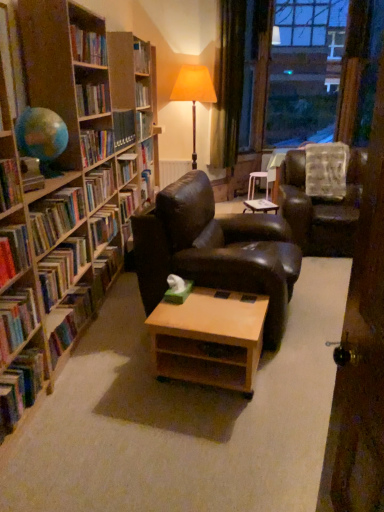
Question: Considering the positions of transparent glass window at upper right and hardcover books at left, marked as the 5th book in a top-to-bottom arrangement, in the image, is transparent glass window at upper right taller or shorter than hardcover books at left, marked as the 5th book in a top-to-bottom arrangement,?

Choices:
 (A) tall
 (B) short

Answer: (A)

Question: Based on their sizes in the image, would you say transparent glass window at upper right is bigger or smaller than hardcover books at left, marked as the 4th book in a bottom-to-top arrangement?

Choices:
 (A) big
 (B) small

Answer: (A)

Question: Which is farther from the leather armchair at center, acting as the 1th chair starting from the front?

Choices:
 (A) hardcover book at lower left, the first book ordered from the bottom
 (B) hardcover book at left, which is the 2th book in bottom-to-top order
 (C) green velvet curtain at upper right
 (D) hardcover book at left, the fourth book positioned from the top
 (E) hardcover books at left, the sixth book when ordered from bottom to top

Answer: (C)

Question: Which object is positioned closest to the leather armchair at center, acting as the 1th chair starting from the front?

Choices:
 (A) hardcover books at left, marked as the 4th book in a bottom-to-top arrangement
 (B) hardcover book at lower left, which is the eighth book in top-to-bottom order
 (C) wooden table at center
 (D) hardcover book at left, the fifth book when ordered from bottom to top
 (E) wooden door at right

Answer: (A)